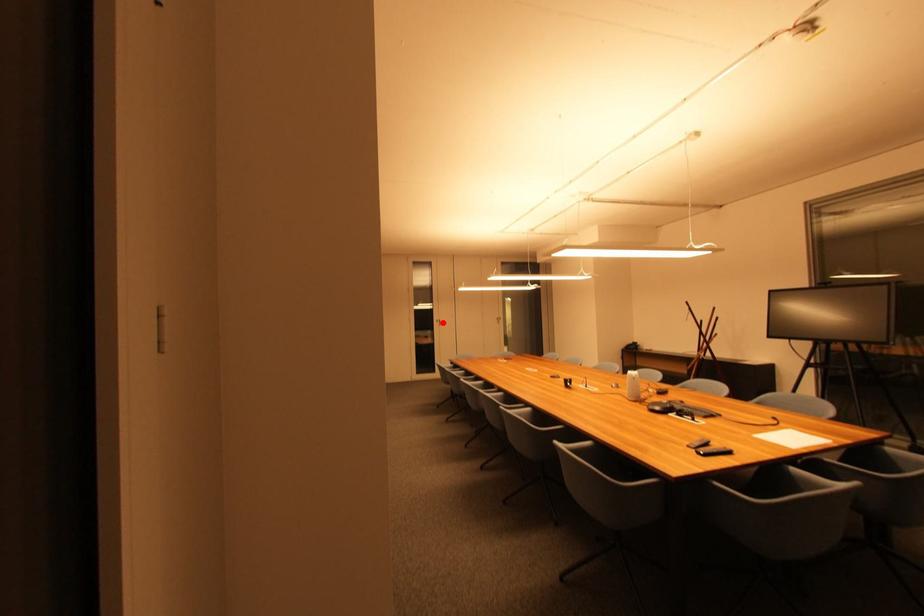
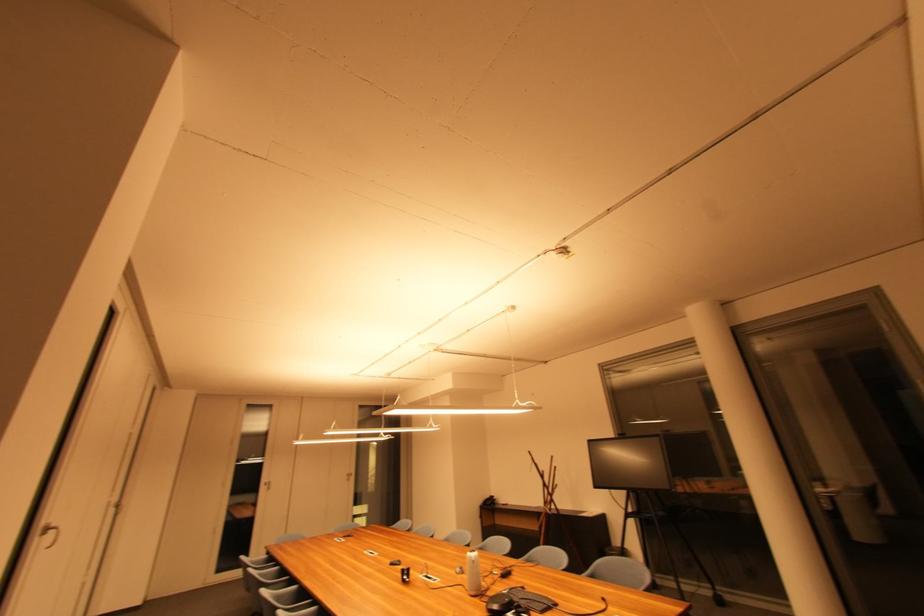
The point at the highlighted location is marked in the first image. Where is the corresponding point in the second image?

(271, 485)